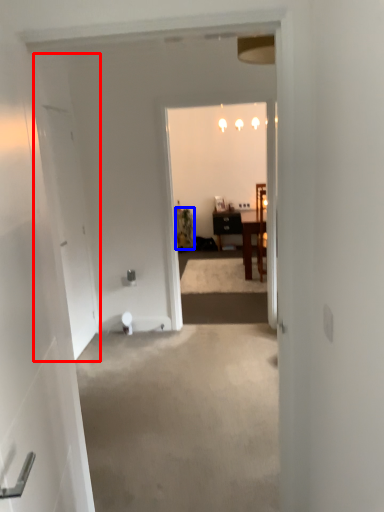
Question: Among these objects, which one is farthest to the camera, door (highlighted by a red box) or houseplant (highlighted by a blue box)?

Choices:
 (A) door
 (B) houseplant

Answer: (B)